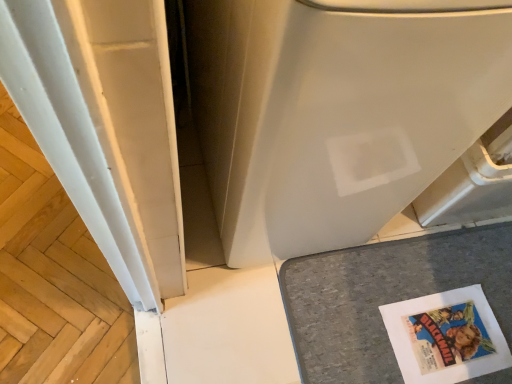
Image resolution: width=512 pixels, height=384 pixels. In order to click on free space above white smooth wood at left (from a real-world perspective) in this screenshot , I will do `click(47, 243)`.